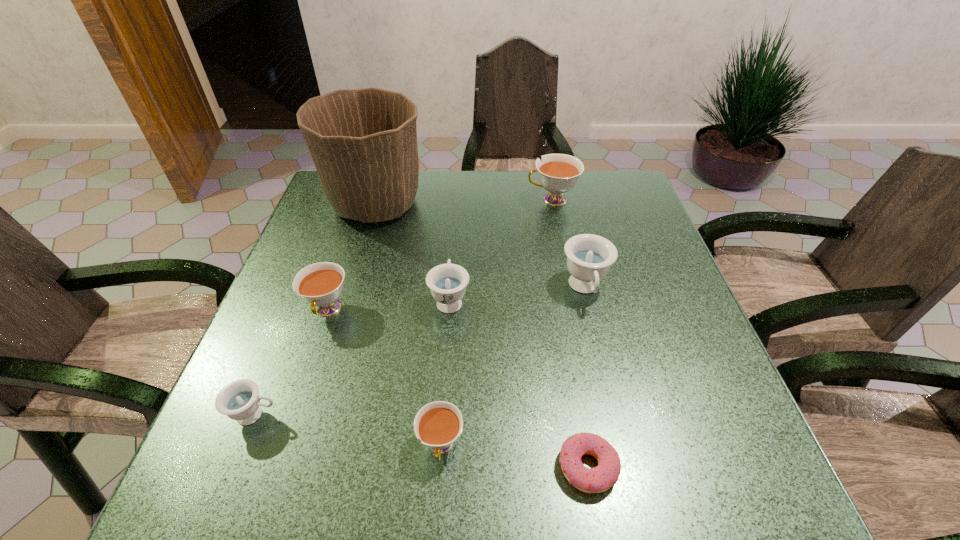
At what (x,y) coordinates should I click in order to perform the action: click on object situated at the right edge. Please return your answer as a coordinate pair (x, y). Looking at the image, I should click on (589, 256).

Find the location of a particular element. The image size is (960, 540). object present at the far left corner is located at coordinates (363, 142).

The height and width of the screenshot is (540, 960). In order to click on vacant area at the far edge in this screenshot , I will do `click(537, 201)`.

Locate an element on the screen. Image resolution: width=960 pixels, height=540 pixels. vacant space at the near edge is located at coordinates (299, 472).

This screenshot has width=960, height=540. In the image, there is a desktop. Identify the location of free space at the left edge. (301, 300).

Locate an element on the screen. The image size is (960, 540). vacant space at the right edge is located at coordinates (681, 305).

This screenshot has width=960, height=540. What are the coordinates of `vacant region at the far left corner of the desktop` in the screenshot? It's located at (322, 197).

In the image, there is a desktop. Where is `vacant space at the far right corner`? This screenshot has height=540, width=960. vacant space at the far right corner is located at coordinates (594, 189).

Find the location of a particular element. Image resolution: width=960 pixels, height=540 pixels. vacant point at the near right corner is located at coordinates (691, 497).

Find the location of a particular element. The width and height of the screenshot is (960, 540). free space that is in between the second blue teacup from left to right and the flowerpot is located at coordinates (413, 252).